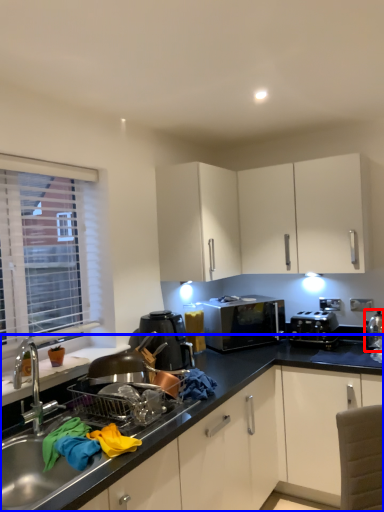
Question: Which object is further to the camera taking this photo, appliance (highlighted by a red box) or countertop (highlighted by a blue box)?

Choices:
 (A) appliance
 (B) countertop

Answer: (A)